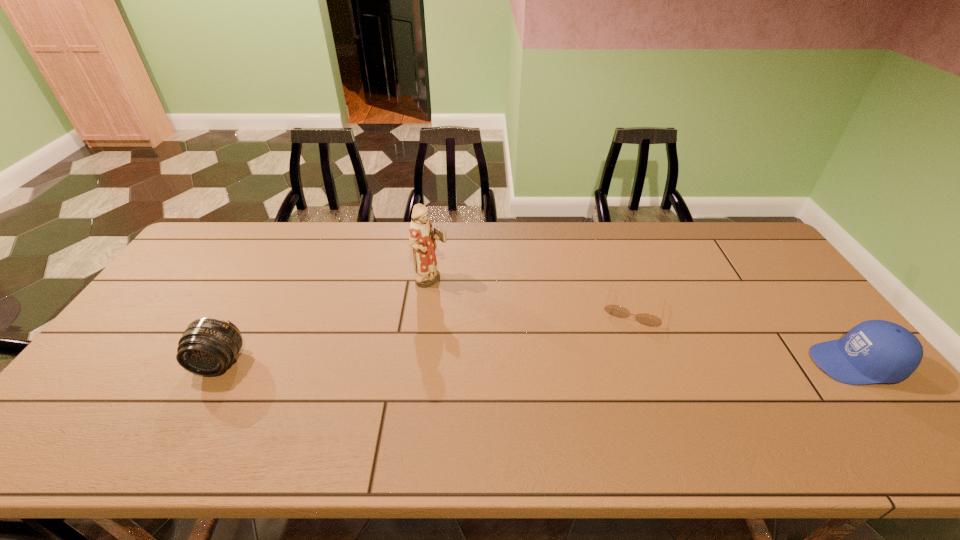
The width and height of the screenshot is (960, 540). In order to click on vacant space located 0.400m on the front-facing side of the second object from left to right in this screenshot , I will do `click(558, 347)`.

Where is `vacant space located 0.190m on the front-facing side of the second object from left to right`? This screenshot has height=540, width=960. vacant space located 0.190m on the front-facing side of the second object from left to right is located at coordinates (494, 314).

You are a GUI agent. You are given a task and a screenshot of the screen. Output one action in this format:
    pyautogui.click(x=<x>, y=<y>)
    Task: Click on the free space located 0.090m on the front-facing side of the second object from left to right
    
    Given the screenshot: What is the action you would take?
    pyautogui.click(x=468, y=299)

The width and height of the screenshot is (960, 540). What are the coordinates of `vacant space positioned 0.190m on the face of the shortest object` in the screenshot? It's located at [615, 379].

Identify the location of vacant point located on the face of the shortest object. (625, 340).

You are a GUI agent. You are given a task and a screenshot of the screen. Output one action in this format:
    pyautogui.click(x=<x>, y=<y>)
    Task: Click on the free region located on the face of the shortest object
    
    Given the screenshot: What is the action you would take?
    pyautogui.click(x=621, y=356)

This screenshot has height=540, width=960. Find the location of `object that is at the near edge`. object that is at the near edge is located at coordinates (875, 351).

Identify the location of object that is at the right edge. (875, 351).

Find the location of `object that is at the near right corner`. object that is at the near right corner is located at coordinates (875, 351).

In the image, there is a desktop. Where is `vacant space at the far edge`? vacant space at the far edge is located at coordinates (537, 256).